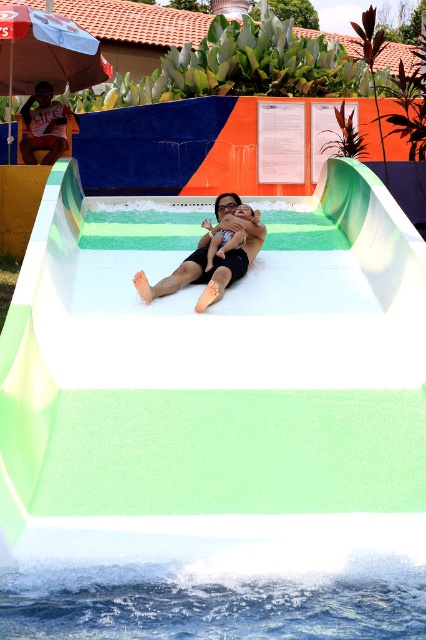
Between white smooth water slide at center and matte orange shorts at upper left, which one is positioned lower?

Positioned lower is white smooth water slide at center.

Does white smooth water slide at center appear under matte orange shorts at upper left?

Correct, white smooth water slide at center is located below matte orange shorts at upper left.

Does point (284, 490) lie behind point (54, 161)?

No.

This screenshot has width=426, height=640. Identify the location of white smooth water slide at center. (215, 390).

Can you confirm if matte black swimsuit at center is positioned to the left of black smooth skin at center?

Correct, you'll find matte black swimsuit at center to the left of black smooth skin at center.

Is matte black swimsuit at center in front of black smooth skin at center?

That is True.

Find the location of `matte black swimsuit at center`. matte black swimsuit at center is located at coordinates (210, 260).

Does point (0, 74) come behind point (45, 145)?

That is True.

Between point (60, 81) and point (54, 134), which one is positioned in front?

Point (54, 134) is more forward.

Where is `white fabric umbrella at upper left`? white fabric umbrella at upper left is located at coordinates (46, 52).

At what (x,y) coordinates should I click in order to perform the action: click on white fabric umbrella at upper left. Please return your answer as a coordinate pair (x, y). Looking at the image, I should click on (46, 52).